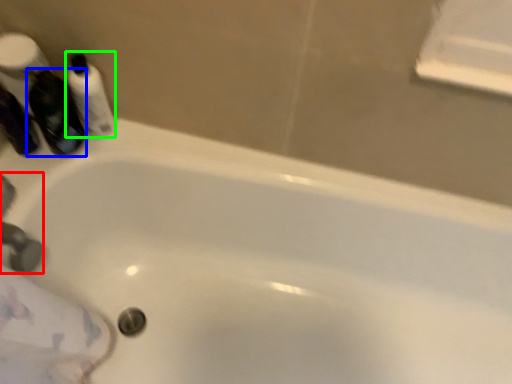
Question: Estimate the real-world distances between objects in this image. Which object is farther from faucet (highlighted by a red box), mouthwash (highlighted by a blue box) or mouthwash (highlighted by a green box)?

Choices:
 (A) mouthwash
 (B) mouthwash

Answer: (B)